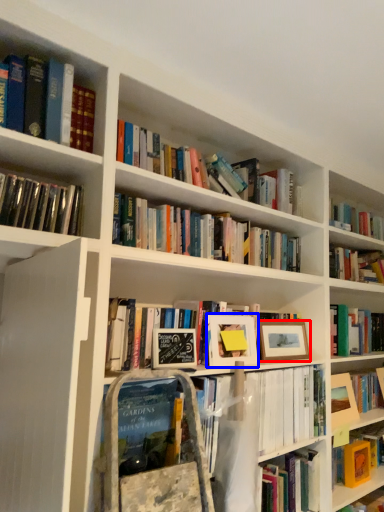
Question: Which object appears closest to the camera in this image, picture frame (highlighted by a red box) or picture frame (highlighted by a blue box)?

Choices:
 (A) picture frame
 (B) picture frame

Answer: (B)